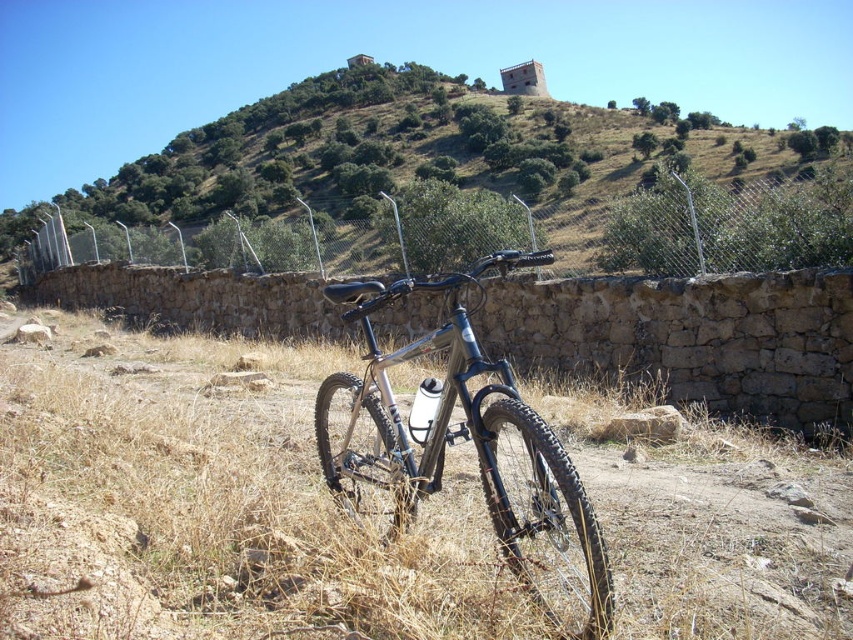
You are a hiker trying to pass through the area shown in the image. You need to walk from the wire mesh fence at center to the shiny metallic bicycle at center. Is the path between them wide enough for you to walk through comfortably?

The wire mesh fence at center might be wider than shiny metallic bicycle at center, so the path between them could be wide enough for comfortable passage. However, since the exact width difference isn not specified, it is recommended to check the space physically before proceeding.

You are navigating a drone that needs to fly over the green grassy hillside at center. What are the coordinates of the hillside to ensure accurate navigation?

The green grassy hillside at center is located at point (454, 188), so the drone should navigate to those coordinates to fly over it.

You are a photographer standing in front of the mountain bike scene. You want to take a photo that includes both point (221, 611) and point (358, 481). Which point will appear larger in your photo?

Point (221, 611) will appear larger in the photo because it is closer to the camera than point (358, 481).